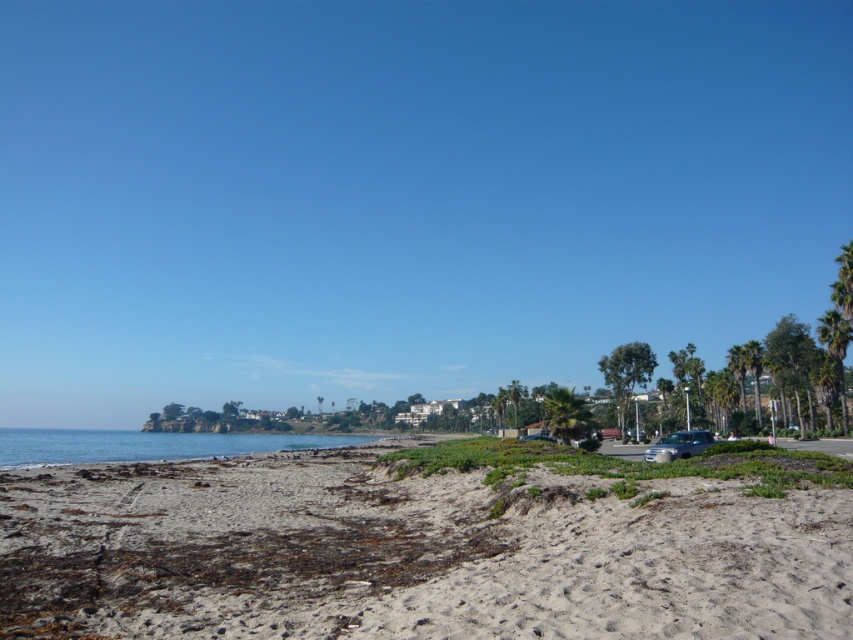
Based on the photo, is blue water at lower left thinner than green leafy palm tree at center?

No, blue water at lower left is not thinner than green leafy palm tree at center.

Who is more forward, (186, 442) or (560, 428)?

Positioned in front is point (560, 428).

Who is more distant from viewer, [193,444] or [561,436]?

→ Point [193,444]

Where is `blue water at lower left`? This screenshot has width=853, height=640. blue water at lower left is located at coordinates (146, 445).

Does point (291, 502) lie behind point (837, 324)?

No, it is not.

Is brown sandy beach at lower center above green leafy palm tree at right?

Incorrect, brown sandy beach at lower center is not positioned above green leafy palm tree at right.

The height and width of the screenshot is (640, 853). I want to click on brown sandy beach at lower center, so click(410, 554).

Who is lower down, brown sandy beach at lower center or green leafy palm tree at center?

Positioned lower is green leafy palm tree at center.

Can you confirm if brown sandy beach at lower center is taller than green leafy palm tree at center?

No.

Between point (460, 524) and point (550, 392), which one is positioned behind?

The point (550, 392) is more distant.

I want to click on brown sandy beach at lower center, so click(410, 554).